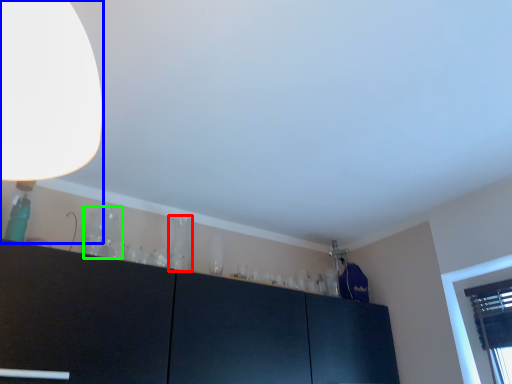
Question: Which is nearer to the glass vase (highlighted by a red box)? lamp (highlighted by a blue box) or glass vase (highlighted by a green box).

Choices:
 (A) lamp
 (B) glass vase

Answer: (B)